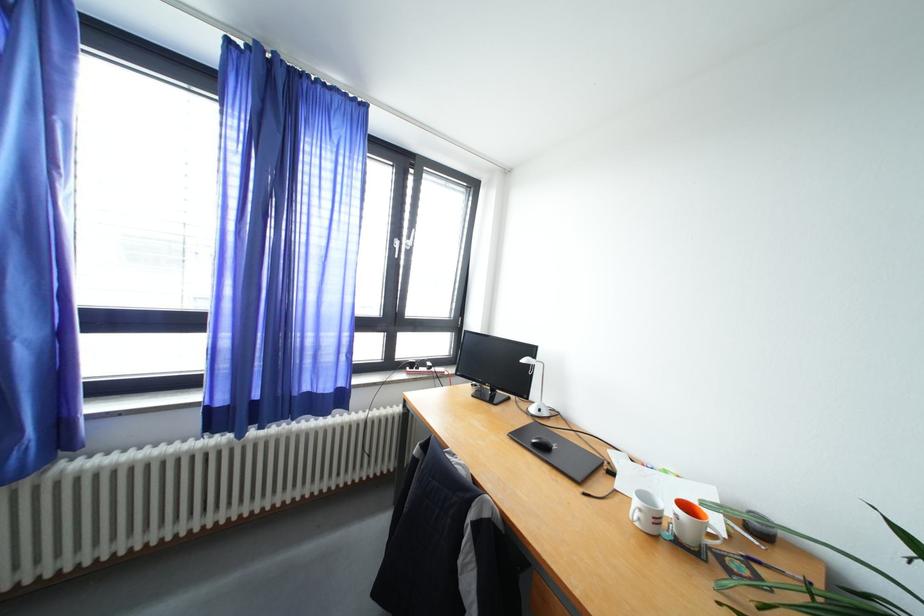
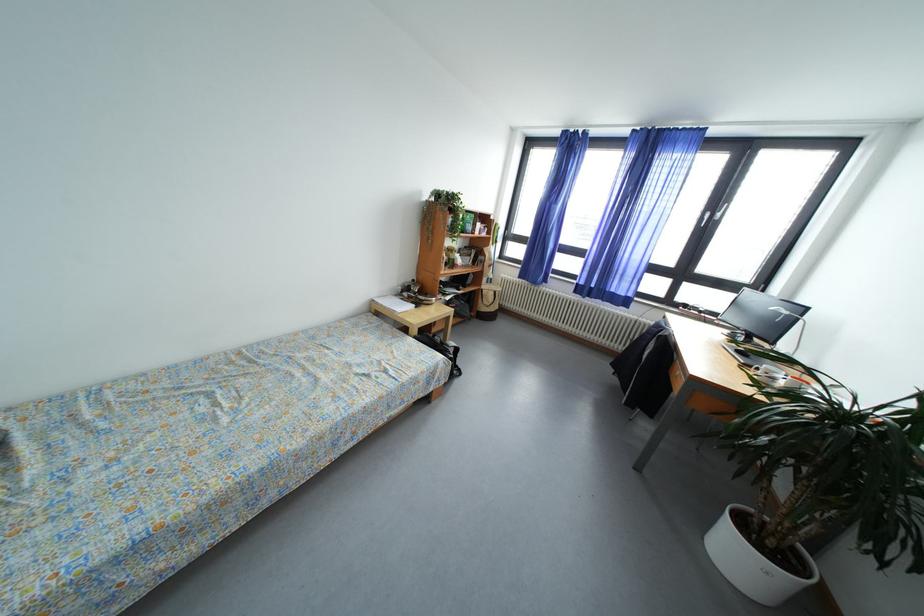
Question: I am providing you with two images of the same scene from different viewpoints. Which of the following objects are not visible in image2?

Choices:
 (A) black backpack
 (B) white desk lamp
 (C) colorful patterned pillow
 (D) black computer mouse

Answer: (B)